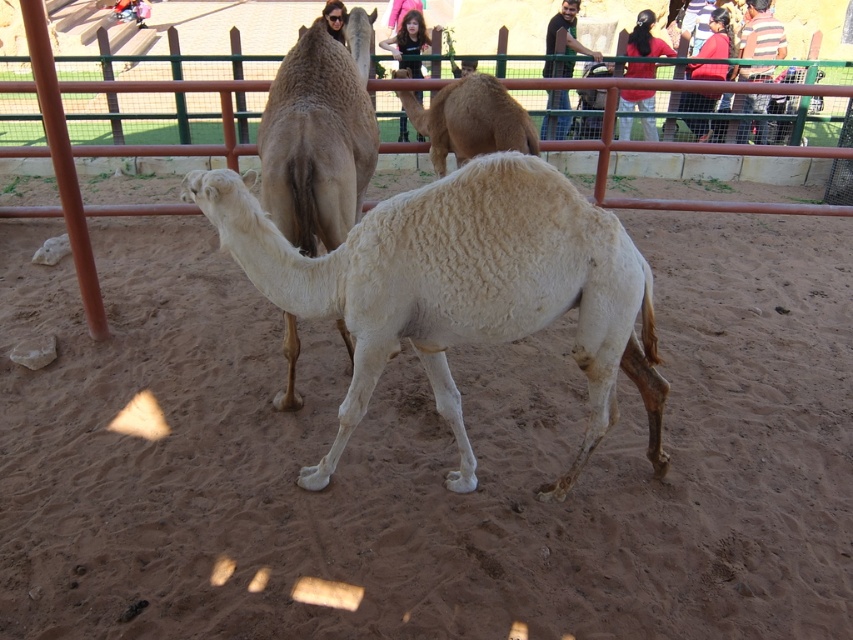
Which of these two, fuzzy white camel at center or brown metal fence at center, stands taller?

Standing taller between the two is fuzzy white camel at center.

Which is more to the left, fuzzy white camel at center or brown metal fence at center?

Positioned to the left is brown metal fence at center.

Is point (321, 243) positioned in front of point (36, 35)?

No, (321, 243) is further to viewer.

You are a GUI agent. You are given a task and a screenshot of the screen. Output one action in this format:
    pyautogui.click(x=<x>, y=<y>)
    Task: Click on the fuzzy white camel at center
    The width and height of the screenshot is (853, 640).
    Given the screenshot: What is the action you would take?
    pyautogui.click(x=318, y=134)

Does white woolen camel at center have a lesser height compared to brown woolen camel at center?

Incorrect, white woolen camel at center's height does not fall short of brown woolen camel at center's.

Is the position of white woolen camel at center less distant than that of brown woolen camel at center?

That is True.

Between point (567, 246) and point (393, 74), which one is positioned behind?

Point (393, 74)

The height and width of the screenshot is (640, 853). I want to click on white woolen camel at center, so click(x=460, y=289).

Can you confirm if brown metal fence at center is shorter than brown woolen camel at center?

Yes.

Can you confirm if brown metal fence at center is positioned above brown woolen camel at center?

Actually, brown metal fence at center is below brown woolen camel at center.

Which is behind, point (601, 196) or point (520, 132)?

Positioned behind is point (601, 196).

Locate an element on the screen. brown metal fence at center is located at coordinates (103, 152).